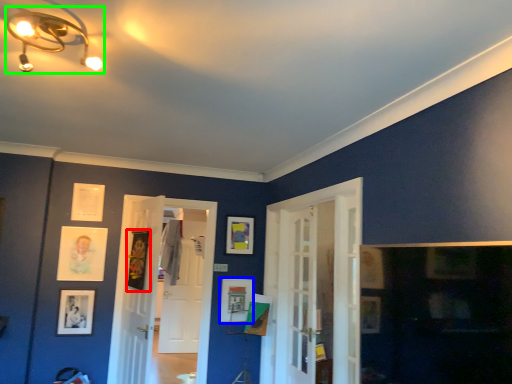
Question: Which object is positioned farthest from picture frame (highlighted by a red box)? Select from picture frame (highlighted by a blue box) and light fixture (highlighted by a green box).

Choices:
 (A) picture frame
 (B) light fixture

Answer: (B)